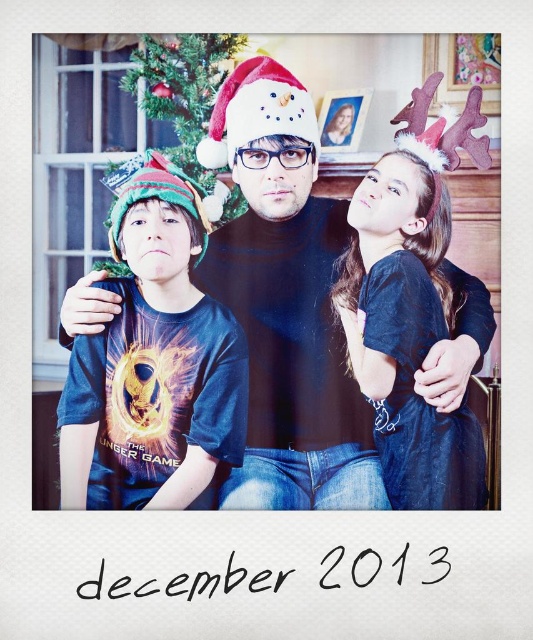
You are standing in front of the Polaroid photo and want to determine the positions of two points marked on the image. Which point, point 1 at coordinates (260,484) or point 2 at coordinates (351,209), is closer to you?

Point 1 at coordinates (260,484) is closer to you because it is further to the viewer than point 2 at coordinates (351,209).

Looking at this image, you are a photographer trying to adjust the lighting in this photo. You need to know which hat is lower in the frame to focus your light properly. Which hat is positioned lower between the black matte santa hat at center and the multicolored knitted hat at left?

The black matte santa hat at center is located below the multicolored knitted hat at left, so it is positioned lower in the frame.

Looking at the Polaroid photo from December 2013, you notice the black matte Santa hat at center and the dark blue denim jeans at lower right. Which object is positioned higher in the image?

The black matte Santa hat at center is positioned higher than the dark blue denim jeans at lower right.